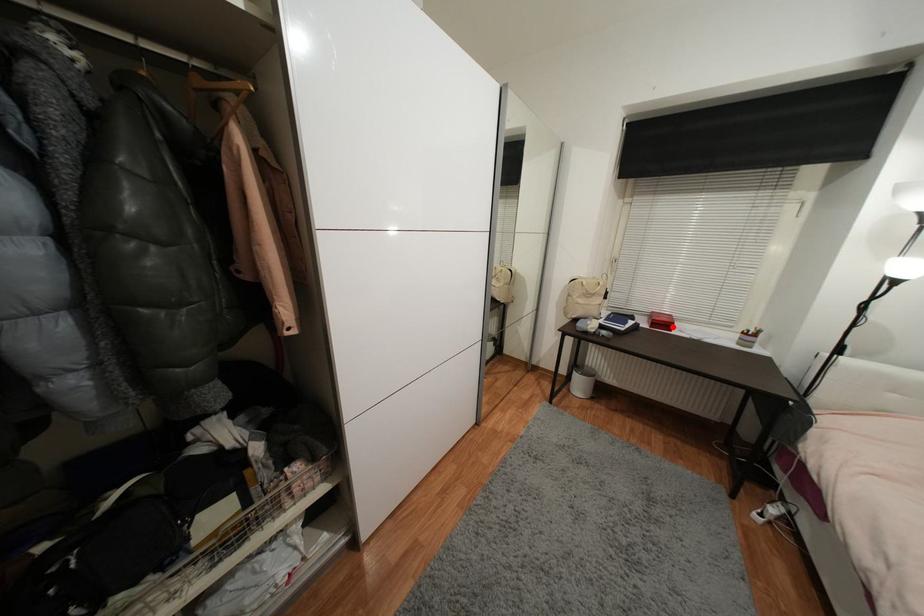
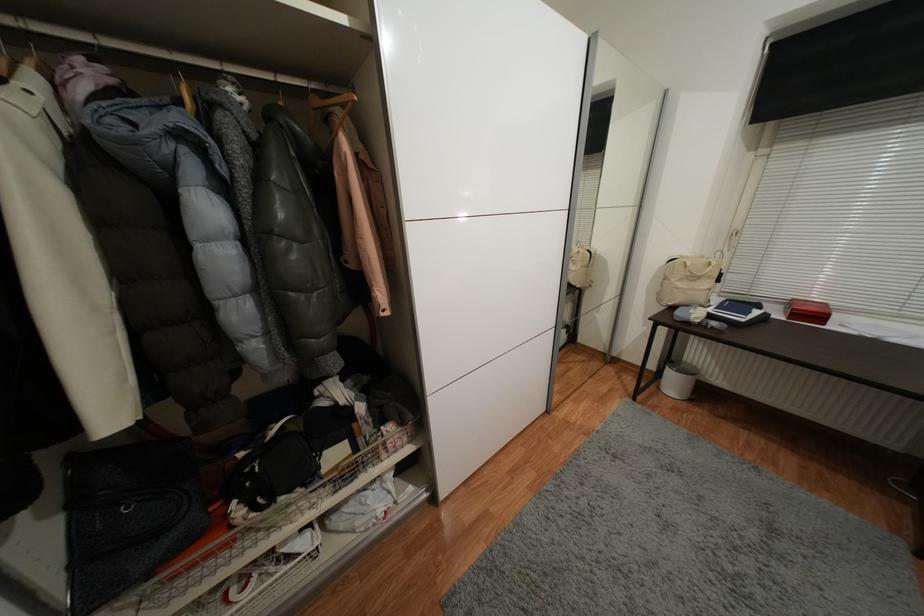
Where in the second image is the point corresponding to the highlighted location from the first image?

(824, 318)